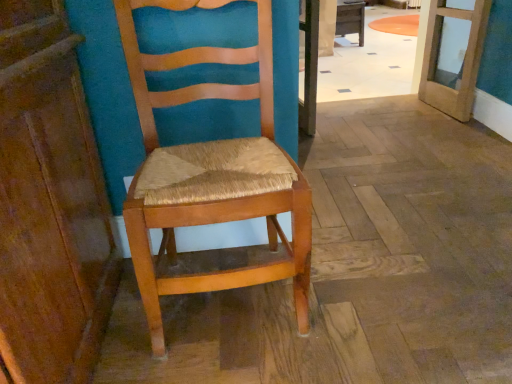
Question: Does wooden door at upper right have a greater width compared to wooden woven seat at center?

Choices:
 (A) no
 (B) yes

Answer: (A)

Question: From a real-world perspective, is wooden door at upper right physically above wooden woven seat at center?

Choices:
 (A) no
 (B) yes

Answer: (A)

Question: Is wooden door at upper right beside wooden woven seat at center?

Choices:
 (A) no
 (B) yes

Answer: (A)

Question: Are wooden door at upper right and wooden woven seat at center far apart?

Choices:
 (A) no
 (B) yes

Answer: (B)

Question: Does wooden door at upper right have a larger size compared to wooden woven seat at center?

Choices:
 (A) no
 (B) yes

Answer: (A)

Question: Considering the relative positions of wooden door at upper right and wooden woven seat at center in the image provided, is wooden door at upper right to the right of wooden woven seat at center from the viewer's perspective?

Choices:
 (A) yes
 (B) no

Answer: (A)

Question: Is wooden woven seat at center facing away from wooden door at upper right?

Choices:
 (A) yes
 (B) no

Answer: (B)

Question: Considering the relative sizes of wooden woven seat at center and wooden door at upper right in the image provided, is wooden woven seat at center bigger than wooden door at upper right?

Choices:
 (A) no
 (B) yes

Answer: (B)

Question: From a real-world perspective, is wooden woven seat at center positioned under wooden door at upper right based on gravity?

Choices:
 (A) no
 (B) yes

Answer: (A)

Question: Is wooden woven seat at center aimed at wooden door at upper right?

Choices:
 (A) yes
 (B) no

Answer: (B)

Question: Is the surface of wooden woven seat at center in direct contact with wooden door at upper right?

Choices:
 (A) yes
 (B) no

Answer: (B)

Question: Is the position of wooden woven seat at center more distant than that of wooden door at upper right?

Choices:
 (A) no
 (B) yes

Answer: (A)

Question: Can you confirm if wooden table at center is positioned to the left of wooden door at upper right?

Choices:
 (A) yes
 (B) no

Answer: (B)